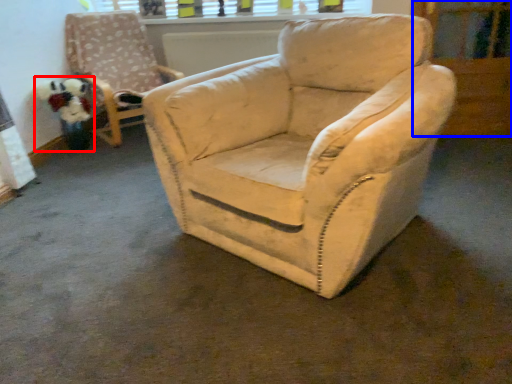
Question: Which object appears farthest to the camera in this image, toy (highlighted by a red box) or screen door (highlighted by a blue box)?

Choices:
 (A) toy
 (B) screen door

Answer: (A)